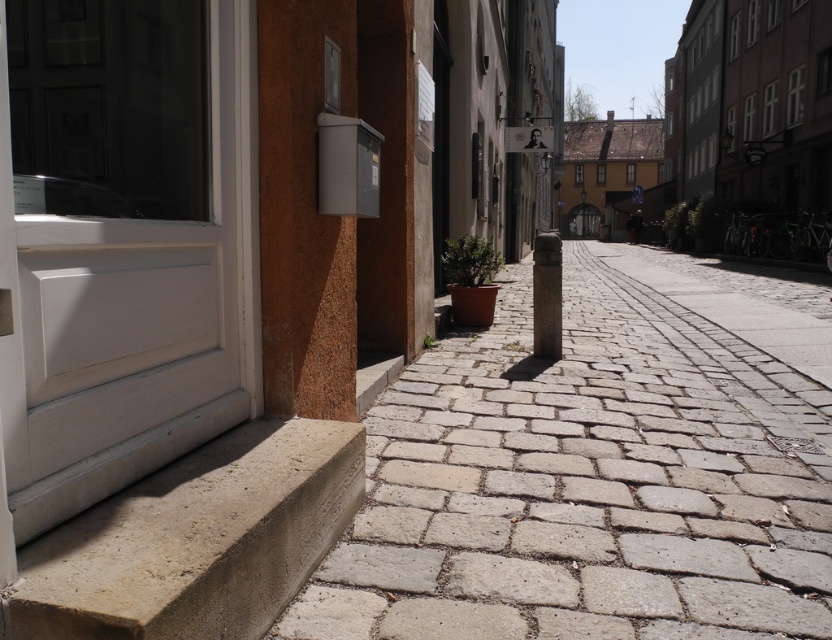
Question: In this image, where is gray stone pavement at lower center located relative to concrete step at lower left?

Choices:
 (A) right
 (B) left

Answer: (A)

Question: Estimate the real-world distances between objects in this image. Which object is farther from the concrete step at lower left?

Choices:
 (A) gray stone pavement at lower center
 (B) smooth stone pillar at center

Answer: (B)

Question: Which is nearer to the gray stone pavement at lower center?

Choices:
 (A) smooth stone pillar at center
 (B) concrete step at lower left

Answer: (B)

Question: Which object is the closest to the gray stone pavement at lower center?

Choices:
 (A) smooth stone pillar at center
 (B) concrete step at lower left

Answer: (B)

Question: Is gray stone pavement at lower center wider than smooth stone pillar at center?

Choices:
 (A) yes
 (B) no

Answer: (B)

Question: Does concrete step at lower left appear under smooth stone pillar at center?

Choices:
 (A) yes
 (B) no

Answer: (A)